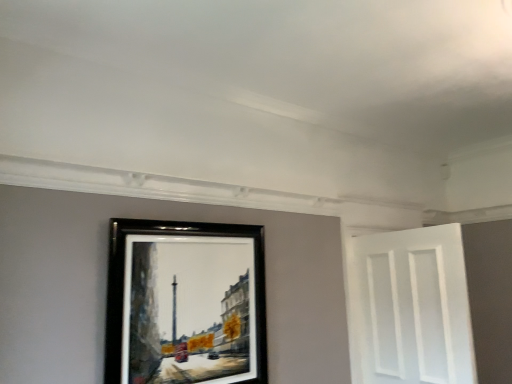
Question: Is black wooden picture frame at upper center thinner than white matte door at right?

Choices:
 (A) yes
 (B) no

Answer: (A)

Question: Is white matte door at right located within black wooden picture frame at upper center?

Choices:
 (A) no
 (B) yes

Answer: (A)

Question: Is black wooden picture frame at upper center oriented away from white matte door at right?

Choices:
 (A) no
 (B) yes

Answer: (A)

Question: Considering the relative sizes of black wooden picture frame at upper center and white matte door at right in the image provided, is black wooden picture frame at upper center smaller than white matte door at right?

Choices:
 (A) yes
 (B) no

Answer: (A)

Question: Considering the relative positions of black wooden picture frame at upper center and white matte door at right in the image provided, is black wooden picture frame at upper center to the right of white matte door at right from the viewer's perspective?

Choices:
 (A) yes
 (B) no

Answer: (B)

Question: Is black wooden picture frame at upper center positioned beyond the bounds of white matte door at right?

Choices:
 (A) yes
 (B) no

Answer: (A)

Question: From a real-world perspective, is white matte door at right positioned over black wooden picture frame at upper center based on gravity?

Choices:
 (A) yes
 (B) no

Answer: (B)

Question: Considering the relative sizes of white matte door at right and black wooden picture frame at upper center in the image provided, is white matte door at right wider than black wooden picture frame at upper center?

Choices:
 (A) yes
 (B) no

Answer: (A)

Question: From a real-world perspective, is white matte door at right under black wooden picture frame at upper center?

Choices:
 (A) no
 (B) yes

Answer: (B)

Question: Is black wooden picture frame at upper center located within white matte door at right?

Choices:
 (A) yes
 (B) no

Answer: (B)

Question: Is white matte door at right to the left of black wooden picture frame at upper center from the viewer's perspective?

Choices:
 (A) no
 (B) yes

Answer: (A)

Question: Is white matte door at right next to black wooden picture frame at upper center and touching it?

Choices:
 (A) yes
 (B) no

Answer: (B)

Question: Is white matte door at right inside or outside of black wooden picture frame at upper center?

Choices:
 (A) outside
 (B) inside

Answer: (A)